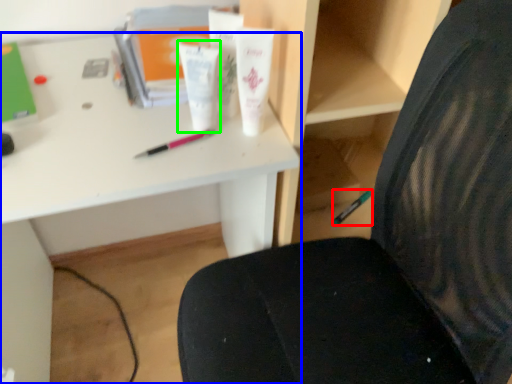
Question: Considering the real-world distances, which object is closest to stationery (highlighted by a red box)? desk (highlighted by a blue box) or toiletry (highlighted by a green box).

Choices:
 (A) desk
 (B) toiletry

Answer: (A)